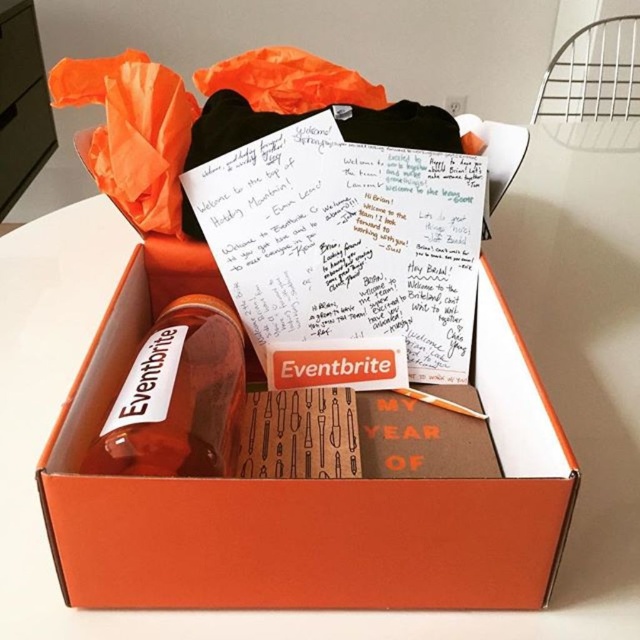
Between orange matte box at center and orange matte drawer at upper left, which one appears on the right side from the viewer's perspective?

orange matte box at center is more to the right.

Can you confirm if orange matte box at center is shorter than orange matte drawer at upper left?

Yes.

Describe the element at coordinates (305, 493) in the screenshot. I see `orange matte box at center` at that location.

Where is `orange matte box at center`? This screenshot has height=640, width=640. orange matte box at center is located at coordinates (305, 493).

Does orange matte box at center have a smaller size compared to translucent glass bottle at center?

No, orange matte box at center is not smaller than translucent glass bottle at center.

Who is taller, orange matte box at center or translucent glass bottle at center?

With more height is orange matte box at center.

What do you see at coordinates (305, 493) in the screenshot? This screenshot has width=640, height=640. I see `orange matte box at center` at bounding box center [305, 493].

What are the coordinates of `orange matte box at center` in the screenshot? It's located at (x=305, y=493).

This screenshot has width=640, height=640. Describe the element at coordinates (179, 397) in the screenshot. I see `translucent glass bottle at center` at that location.

The width and height of the screenshot is (640, 640). Find the location of `translucent glass bottle at center`. translucent glass bottle at center is located at coordinates (179, 397).

Which is in front, point (189, 460) or point (16, 188)?

Point (189, 460)

Locate an element on the screen. The width and height of the screenshot is (640, 640). translucent glass bottle at center is located at coordinates (179, 397).